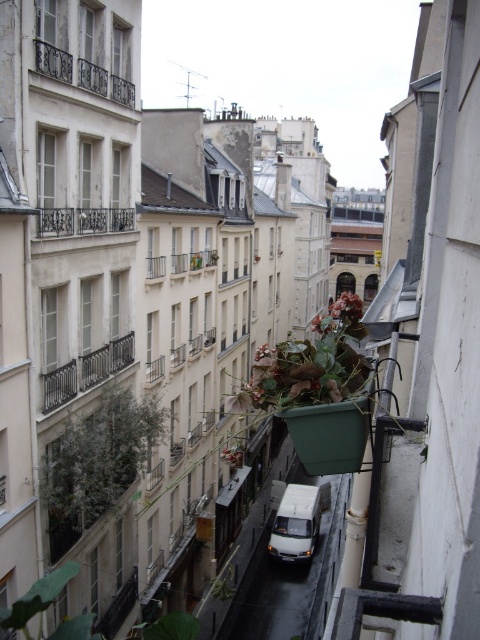
Question: Which object is closer to the camera taking this photo?

Choices:
 (A) dark gray metal balcony at center-left
 (B) polished metal balcony at upper left
 (C) green matte plant at center
 (D) white matte van at center

Answer: (A)

Question: Is green leafy plant at lower center above green matte plant at center?

Choices:
 (A) yes
 (B) no

Answer: (A)

Question: Estimate the real-world distances between objects in this image. Which object is farther from the green leafy plant at lower center?

Choices:
 (A) white matte van at center
 (B) dark wrought iron balcony at upper left
 (C) wooden balcony at center
 (D) green leafy plant at center

Answer: (B)

Question: Which object appears closest to the camera in this image?

Choices:
 (A) polished metal balcony at upper left
 (B) dark wrought iron balcony at upper left
 (C) white matte van at center

Answer: (B)

Question: Does white matte van at center have a smaller size compared to polished metal balcony at upper left?

Choices:
 (A) no
 (B) yes

Answer: (A)

Question: Is dark gray metal balcony at center-left to the left of dark wrought iron balcony at upper left from the viewer's perspective?

Choices:
 (A) yes
 (B) no

Answer: (A)